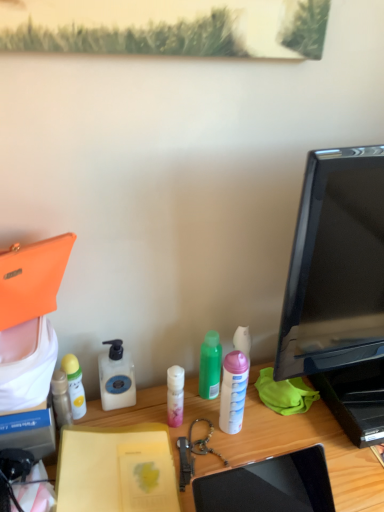
Where is `vacant space to the right of yellow matte bottle at left, acting as the 4th bottle starting from the right`? The image size is (384, 512). vacant space to the right of yellow matte bottle at left, acting as the 4th bottle starting from the right is located at coordinates (142, 416).